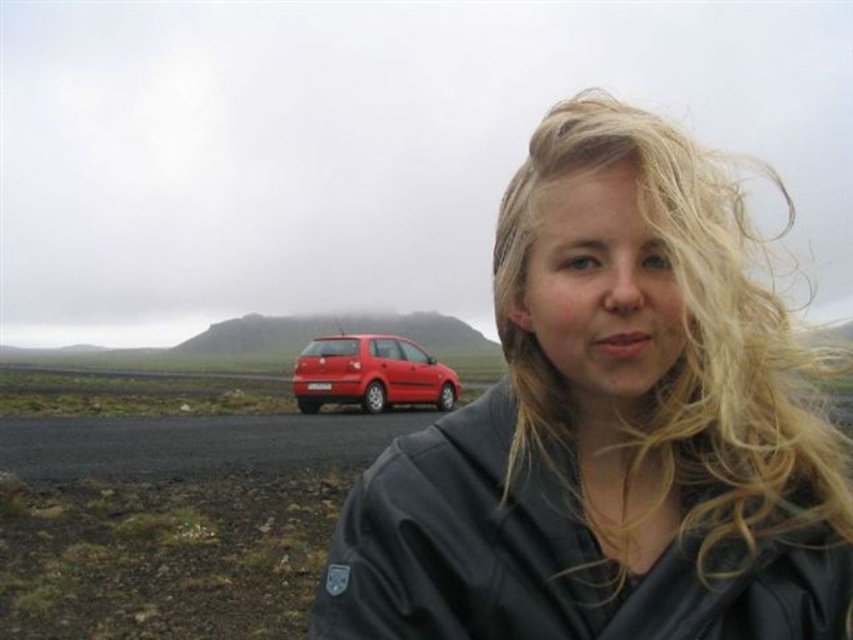
Question: Which point is closer to the camera?

Choices:
 (A) (299, 396)
 (B) (618, 266)

Answer: (B)

Question: Which of the following is the closest to the observer?

Choices:
 (A) shiny red hatchback at center
 (B) blonde silky hair at center

Answer: (B)

Question: Is blonde silky hair at center above shiny red hatchback at center?

Choices:
 (A) yes
 (B) no

Answer: (A)

Question: Does blonde silky hair at center appear on the right side of shiny red hatchback at center?

Choices:
 (A) yes
 (B) no

Answer: (A)

Question: Is blonde silky hair at center smaller than shiny red hatchback at center?

Choices:
 (A) no
 (B) yes

Answer: (A)